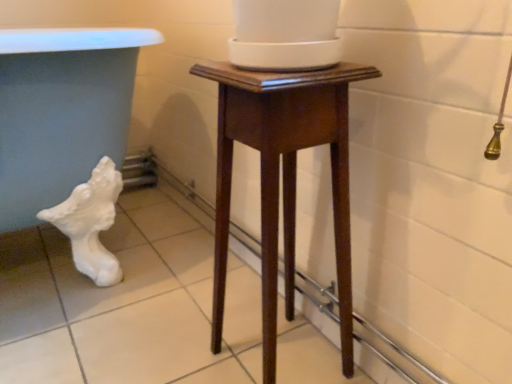
Describe the element at coordinates (283, 178) in the screenshot. The height and width of the screenshot is (384, 512). I see `mahogany wood pedestal at center` at that location.

Measure the distance between mahogany wood pedestal at center and camera.

The distance of mahogany wood pedestal at center from camera is 59.40 centimeters.

Identify the location of mahogany wood pedestal at center. Image resolution: width=512 pixels, height=384 pixels. (283, 178).

Locate an element on the screen. This screenshot has height=384, width=512. mahogany wood pedestal at center is located at coordinates (283, 178).